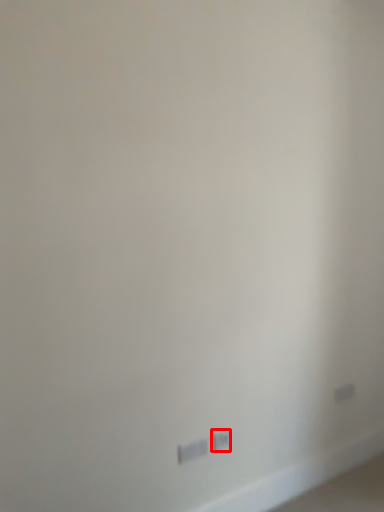
Question: From the image's perspective, where is power plugs and sockets (annotated by the red box) located relative to power plugs and sockets?

Choices:
 (A) above
 (B) below

Answer: (A)